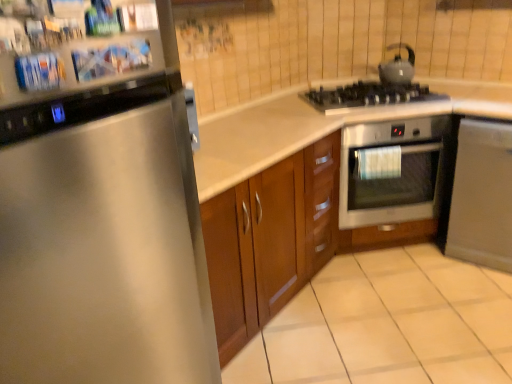
Image resolution: width=512 pixels, height=384 pixels. What do you see at coordinates (101, 212) in the screenshot?
I see `stainless steel refrigerator at left` at bounding box center [101, 212].

This screenshot has width=512, height=384. What do you see at coordinates (482, 195) in the screenshot?
I see `satin silver dishwasher at lower right` at bounding box center [482, 195].

The width and height of the screenshot is (512, 384). What do you see at coordinates (290, 189) in the screenshot? I see `white glossy countertop at center` at bounding box center [290, 189].

Describe the element at coordinates (390, 171) in the screenshot. I see `stainless steel oven at center-right` at that location.

Measure the distance between point (409, 81) and camera.

8.15 feet.

Locate an element on the screen. The width and height of the screenshot is (512, 384). stainless steel refrigerator at left is located at coordinates coord(101,212).

From a real-world perspective, is stainless steel oven at center-right physically located above or below white glossy countertop at center?

stainless steel oven at center-right is situated higher than white glossy countertop at center in the real world.

Does stainless steel oven at center-right have a lesser height compared to white glossy countertop at center?

Yes.

Is stainless steel oven at center-right facing away from white glossy countertop at center?

That's right, stainless steel oven at center-right is facing away from white glossy countertop at center.

From the picture: Could you tell me if black matte gas stove at upper right is turned towards stainless steel refrigerator at left?

No.

Does black matte gas stove at upper right have a greater width compared to stainless steel refrigerator at left?

No, black matte gas stove at upper right is not wider than stainless steel refrigerator at left.

Does black matte gas stove at upper right have a lesser height compared to stainless steel refrigerator at left?

Correct, black matte gas stove at upper right is not as tall as stainless steel refrigerator at left.

Which is less distant, (371,106) or (135,305)?

Positioned in front is point (135,305).

In the scene shown: Is satin silver dishwasher at lower right smaller than matte black kettle at upper right?

No.

Is satin silver dishwasher at lower right located outside matte black kettle at upper right?

Yes, satin silver dishwasher at lower right is located beyond the bounds of matte black kettle at upper right.

Is satin silver dishwasher at lower right positioned with its back to matte black kettle at upper right?

No, matte black kettle at upper right is not at the back of satin silver dishwasher at lower right.

Considering the sizes of objects satin silver dishwasher at lower right and matte black kettle at upper right in the image provided, who is shorter, satin silver dishwasher at lower right or matte black kettle at upper right?

Standing shorter between the two is matte black kettle at upper right.

Is white glossy countertop at center to the left of stainless steel refrigerator at left from the viewer's perspective?

No.

Does white glossy countertop at center lie behind stainless steel refrigerator at left?

Yes, it is behind stainless steel refrigerator at left.

In the scene shown: Who is bigger, white glossy countertop at center or stainless steel refrigerator at left?

white glossy countertop at center is bigger.

From their relative heights in the image, would you say white glossy countertop at center is taller or shorter than stainless steel refrigerator at left?

Considering their sizes, white glossy countertop at center has less height than stainless steel refrigerator at left.

Does black matte gas stove at upper right have a smaller size compared to satin silver dishwasher at lower right?

Indeed, black matte gas stove at upper right has a smaller size compared to satin silver dishwasher at lower right.

Which object is thinner, black matte gas stove at upper right or satin silver dishwasher at lower right?

black matte gas stove at upper right is thinner.

From a real-world perspective, is black matte gas stove at upper right on satin silver dishwasher at lower right?

Yes.

Can we say black matte gas stove at upper right lies outside satin silver dishwasher at lower right?

Yes, black matte gas stove at upper right is outside of satin silver dishwasher at lower right.

Which of these two, satin silver dishwasher at lower right or stainless steel refrigerator at left, is bigger?

stainless steel refrigerator at left.

Does satin silver dishwasher at lower right touch stainless steel refrigerator at left?

No, satin silver dishwasher at lower right is not in contact with stainless steel refrigerator at left.

Looking at their sizes, would you say satin silver dishwasher at lower right is wider or thinner than stainless steel refrigerator at left?

Clearly, satin silver dishwasher at lower right has more width compared to stainless steel refrigerator at left.

From a real-world perspective, who is located lower, satin silver dishwasher at lower right or stainless steel refrigerator at left?

In real-world perspective, satin silver dishwasher at lower right is lower.

Consider the image. Does matte black kettle at upper right turn towards black matte gas stove at upper right?

No, matte black kettle at upper right is not aimed at black matte gas stove at upper right.

Which object is wider, matte black kettle at upper right or black matte gas stove at upper right?

black matte gas stove at upper right.

Does matte black kettle at upper right have a lesser height compared to black matte gas stove at upper right?

Incorrect, the height of matte black kettle at upper right does not fall short of that of black matte gas stove at upper right.

Is there a large distance between matte black kettle at upper right and black matte gas stove at upper right?

No, matte black kettle at upper right is in close proximity to black matte gas stove at upper right.

Locate an element on the screen. The image size is (512, 384). oven that appears above the white glossy countertop at center (from the image's perspective) is located at coordinates (390, 171).

The height and width of the screenshot is (384, 512). In order to click on gas stove located on the right of stainless steel refrigerator at left in this screenshot , I will do `click(369, 95)`.

From the picture: Which object lies nearer to the anchor point stainless steel oven at center-right, stainless steel refrigerator at left or satin silver dishwasher at lower right?

The object closer to stainless steel oven at center-right is satin silver dishwasher at lower right.

Which object lies further to the anchor point stainless steel refrigerator at left, satin silver dishwasher at lower right or white glossy countertop at center?

The object further to stainless steel refrigerator at left is satin silver dishwasher at lower right.

Looking at the image, which one is located further to stainless steel oven at center-right, black matte gas stove at upper right or white glossy countertop at center?

Among the two, white glossy countertop at center is located further to stainless steel oven at center-right.

From the image, which object appears to be nearer to stainless steel refrigerator at left, black matte gas stove at upper right or stainless steel oven at center-right?

stainless steel oven at center-right is closer to stainless steel refrigerator at left.

Based on their spatial positions, is white glossy countertop at center or black matte gas stove at upper right further from matte black kettle at upper right?

white glossy countertop at center is positioned further to the anchor matte black kettle at upper right.

When comparing their distances from black matte gas stove at upper right, does stainless steel refrigerator at left or white glossy countertop at center seem closer?

white glossy countertop at center lies closer to black matte gas stove at upper right than the other object.

Based on their spatial positions, is stainless steel oven at center-right or stainless steel refrigerator at left closer to black matte gas stove at upper right?

stainless steel oven at center-right is closer to black matte gas stove at upper right.

Estimate the real-world distances between objects in this image. Which object is closer to stainless steel refrigerator at left, satin silver dishwasher at lower right or black matte gas stove at upper right?

black matte gas stove at upper right.

At what (x,y) coordinates should I click in order to perform the action: click on dish washer between white glossy countertop at center and matte black kettle at upper right from front to back. Please return your answer as a coordinate pair (x, y). Looking at the image, I should click on (482, 195).

Image resolution: width=512 pixels, height=384 pixels. I want to click on dish washer between white glossy countertop at center and black matte gas stove at upper right from front to back, so click(x=482, y=195).

Where is `oven between stainless steel refrigerator at left and black matte gas stove at upper right from front to back`? The width and height of the screenshot is (512, 384). oven between stainless steel refrigerator at left and black matte gas stove at upper right from front to back is located at coordinates (390, 171).

Where is `oven located between stainless steel refrigerator at left and satin silver dishwasher at lower right in the left-right direction`? The height and width of the screenshot is (384, 512). oven located between stainless steel refrigerator at left and satin silver dishwasher at lower right in the left-right direction is located at coordinates (390, 171).